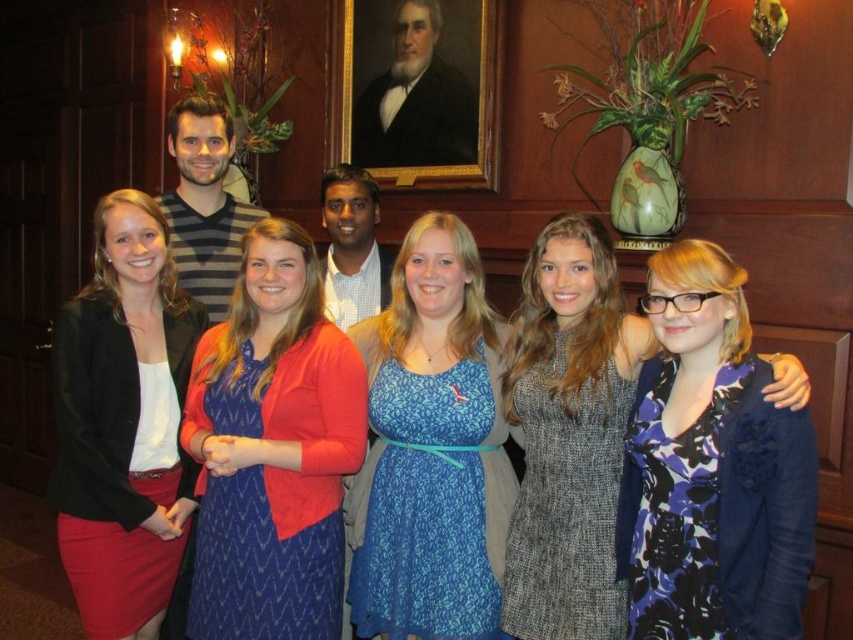
Question: Which point is closer to the camera taking this photo?

Choices:
 (A) (100, 284)
 (B) (675, 282)

Answer: (B)

Question: Which of the following is the farthest from the observer?

Choices:
 (A) (125, 404)
 (B) (202, 572)
 (C) (531, 524)

Answer: (A)

Question: Does blue textured dress at center appear over blue floral dress at center?

Choices:
 (A) no
 (B) yes

Answer: (B)

Question: Does blue lace dress at center have a lesser width compared to matte black blazer at left?

Choices:
 (A) yes
 (B) no

Answer: (B)

Question: Which point is closer to the camera?

Choices:
 (A) blue lace dress at center
 (B) blue floral dress at center
 (C) matte black blazer at left
 (D) blue textured dress at center

Answer: (B)

Question: Is blue lace dress at center further to camera compared to blue floral dress at center?

Choices:
 (A) no
 (B) yes

Answer: (B)